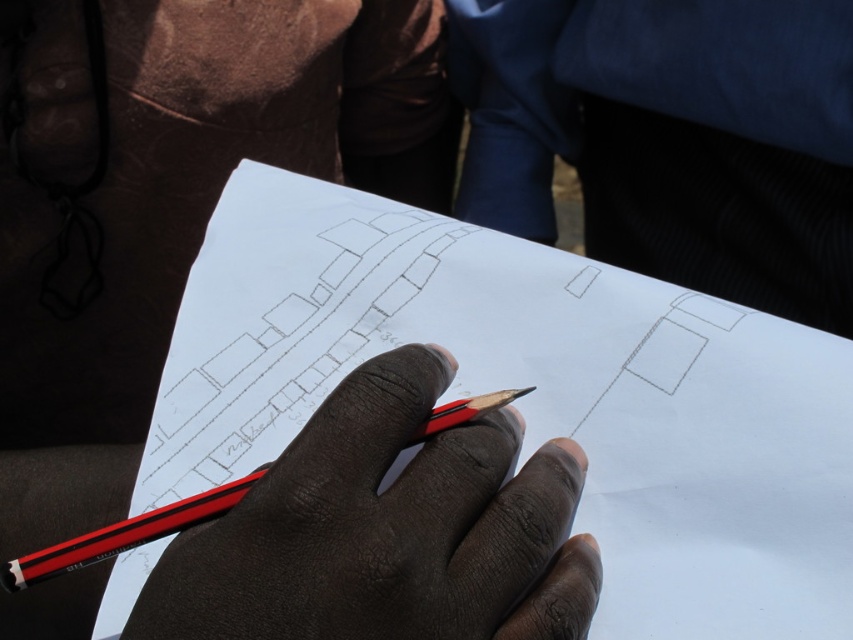
In the scene shown: You are a photographer standing 1 meter away from the white paper at center. Can you reach it without moving your feet?

The white paper at center is 35.82 centimeters from viewer. Since you are standing 1 meter away, which is approximately 100 centimeters, you cannot reach it without moving your feet because the distance is greater than the typical arm length.

You are an artist trying to place a new mark on the paper. You see two points on the paper labeled as point (849, 388) and point (189, 545). Which point is closer to your hand holding the pencil?

Point (849, 388) is further to the viewer than point (189, 545), so the point (189, 545) is closer to your hand holding the pencil.

You are a delivery drone with a package that must be placed between the two points marked as point (x=635, y=572). What is the minimum distance you need to maintain between the package and each point to ensure it stays centered?

The minimum distance to maintain between the package and each point is half of 15.48 inches, which is 7.74 inches.